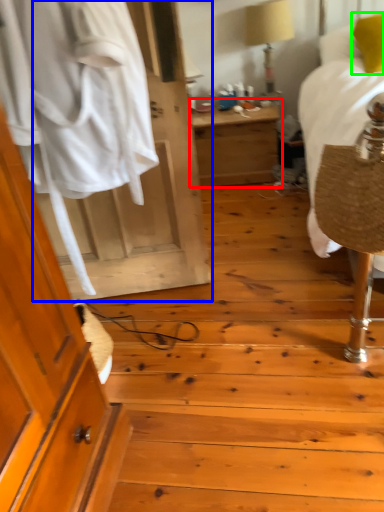
Question: Which object is the closest to the nightstand (highlighted by a red box)? Choose among these: door (highlighted by a blue box) or pillow (highlighted by a green box).

Choices:
 (A) door
 (B) pillow

Answer: (B)